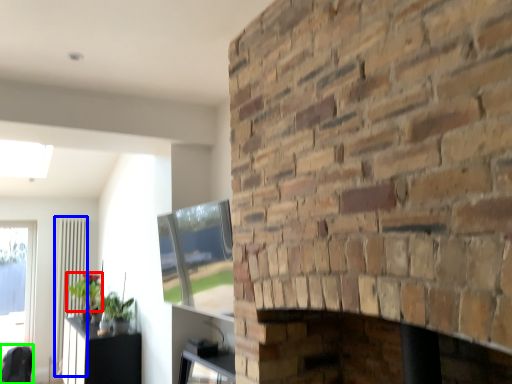
Question: Considering the real-world distances, which object is farthest from plant (highlighted by a red box)? screen door (highlighted by a blue box) or swivel chair (highlighted by a green box)?

Choices:
 (A) screen door
 (B) swivel chair

Answer: (B)